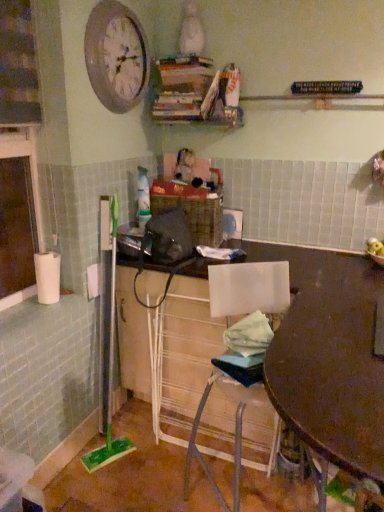
The height and width of the screenshot is (512, 384). Find the location of `free spot above wooden table at center (from a real-world perspective)`. free spot above wooden table at center (from a real-world perspective) is located at coordinates (330, 345).